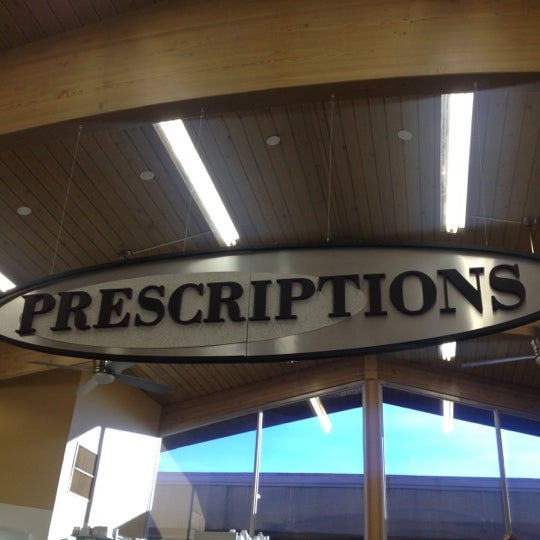
Locate an element on the screen. This screenshot has width=540, height=540. wire suspending sign from ceiling is located at coordinates (63, 225), (182, 239), (320, 228), (484, 219).